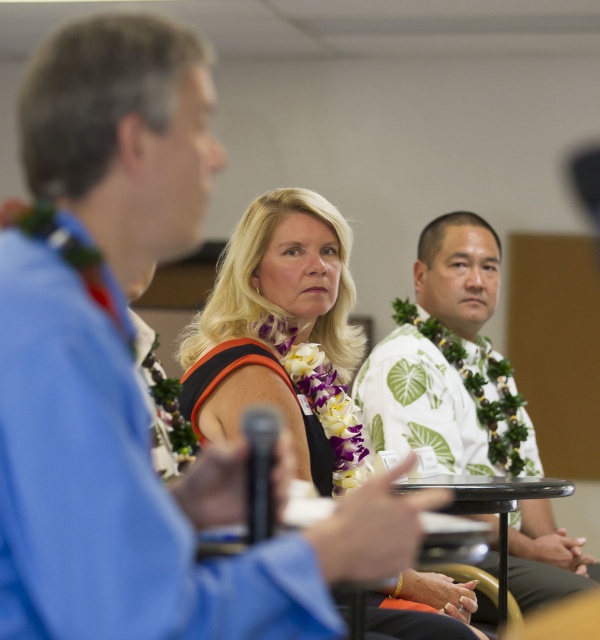
Between point (549, 545) and point (462, 476), which one is positioned in front?

Positioned in front is point (462, 476).

Can you confirm if white leaf-patterned shirt at center is thinner than black plastic table at center?

No, white leaf-patterned shirt at center is not thinner than black plastic table at center.

Is point (544, 524) closer to viewer compared to point (491, 492)?

That is False.

Image resolution: width=600 pixels, height=640 pixels. I want to click on white leaf-patterned shirt at center, so (448, 360).

Consider the image. Is white leaf-patterned shirt at center above black plastic microphone at center?

Actually, white leaf-patterned shirt at center is below black plastic microphone at center.

Does white leaf-patterned shirt at center have a lesser width compared to black plastic microphone at center?

In fact, white leaf-patterned shirt at center might be wider than black plastic microphone at center.

Which is behind, point (444, 390) or point (247, 410)?

Point (444, 390)

This screenshot has height=640, width=600. Identify the location of white leaf-patterned shirt at center. (448, 360).

Can you confirm if black plastic table at center is positioned to the right of black plastic microphone at center?

Indeed, black plastic table at center is positioned on the right side of black plastic microphone at center.

Which is in front, point (499, 532) or point (243, 426)?

Point (243, 426) is more forward.

Locate an element on the screen. black plastic table at center is located at coordinates (493, 506).